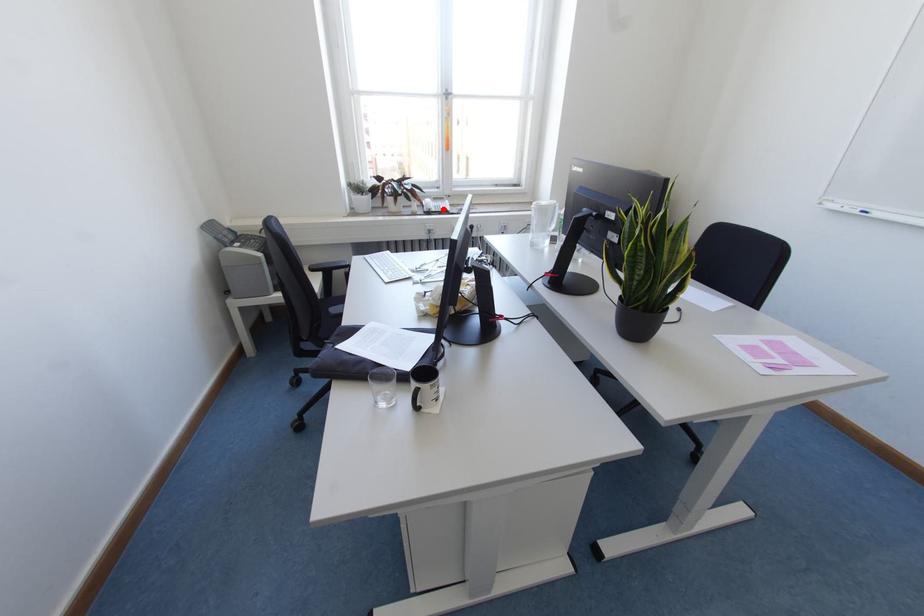
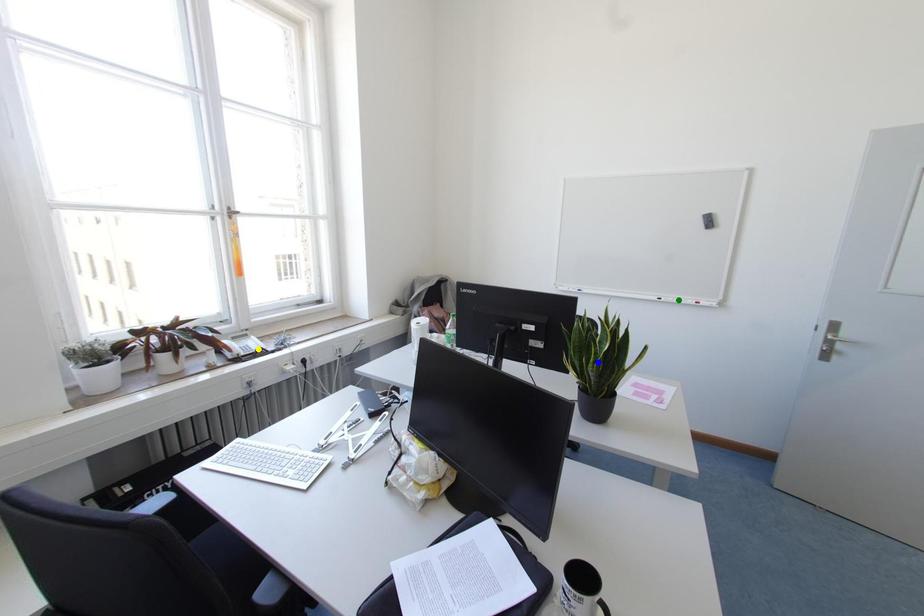
Question: I am providing you with two images of the same scene from different viewpoints. A red point is marked on the first image. You are given multiple points on the second image. Which spot in image 2 lines up with the point in image 1?

Choices:
 (A) yellow point
 (B) green point
 (C) blue point

Answer: (A)